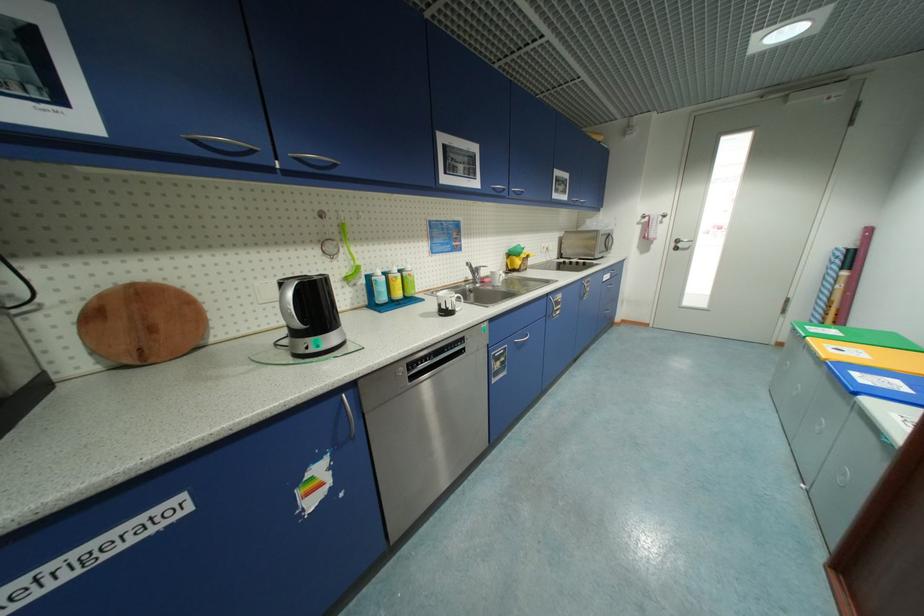
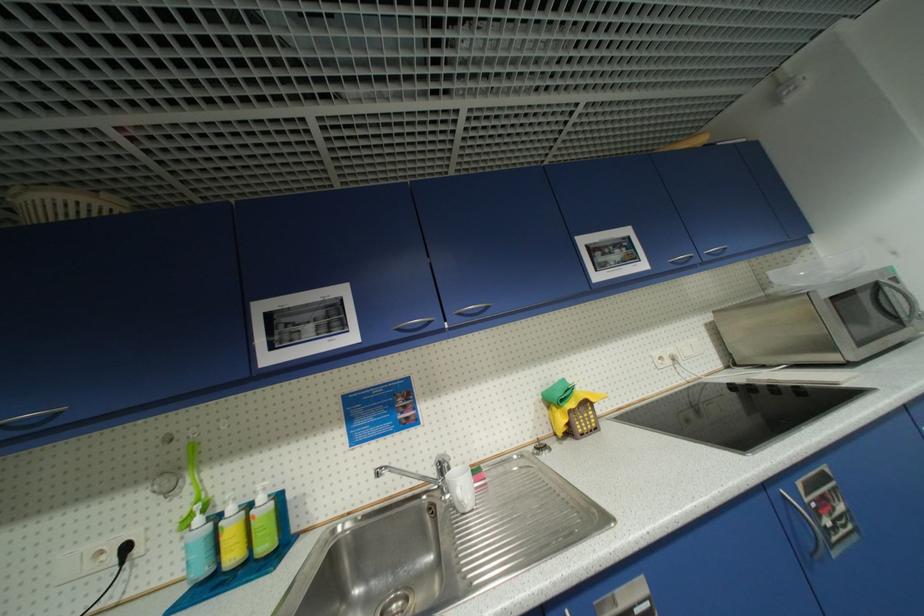
Where in the second image is the point corresponding to pixel 415 269 from the first image?

(266, 500)